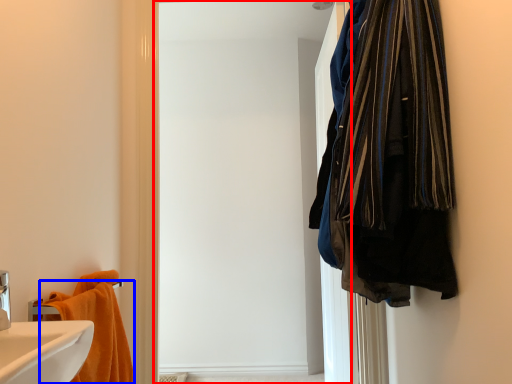
Question: Which object appears closest to the camera in this image, screen door (highlighted by a red box) or towel (highlighted by a blue box)?

Choices:
 (A) screen door
 (B) towel

Answer: (B)